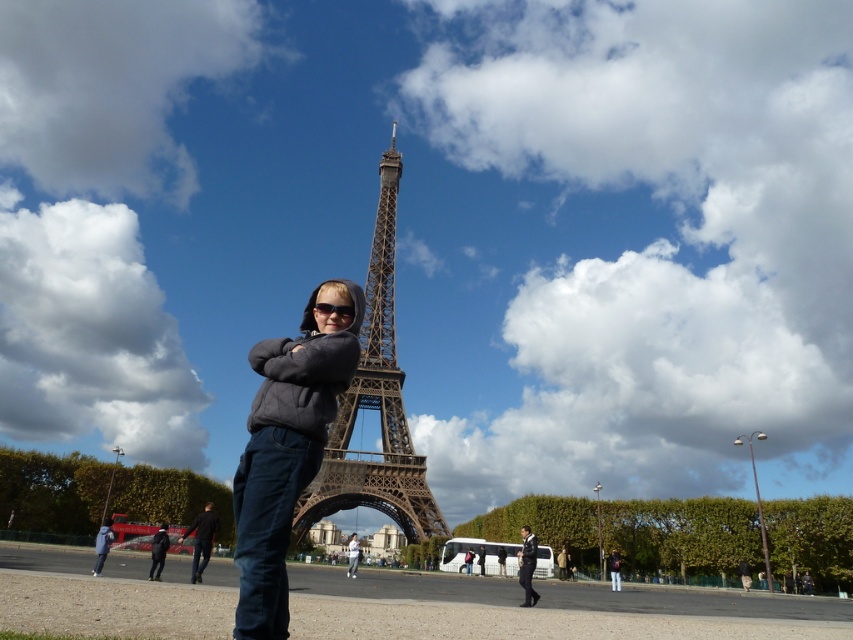
Does point (198, 540) come behind point (531, 554)?

No, it is in front of (531, 554).

Can you confirm if dark blue jeans at lower left is taller than dark blue jeans at lower center?

Indeed, dark blue jeans at lower left has a greater height compared to dark blue jeans at lower center.

The width and height of the screenshot is (853, 640). Describe the element at coordinates (201, 540) in the screenshot. I see `dark blue jeans at lower left` at that location.

The width and height of the screenshot is (853, 640). Identify the location of dark blue jeans at lower left. [201, 540].

Based on the photo, which of these two, brown metal eiffel tower at center or dark blue jeans at lower center, stands shorter?

dark blue jeans at lower center

Between point (389, 227) and point (531, 577), which one is positioned behind?

Positioned behind is point (389, 227).

Identify the location of brown metal eiffel tower at center. (375, 404).

Who is positioned more to the left, matte gray hoodie at center or brown metal eiffel tower at center?

From the viewer's perspective, matte gray hoodie at center appears more on the left side.

Who is positioned more to the right, matte gray hoodie at center or brown metal eiffel tower at center?

From the viewer's perspective, brown metal eiffel tower at center appears more on the right side.

Is point (315, 337) farther from viewer compared to point (376, 333)?

That is False.

Locate an element on the screen. matte gray hoodie at center is located at coordinates (287, 445).